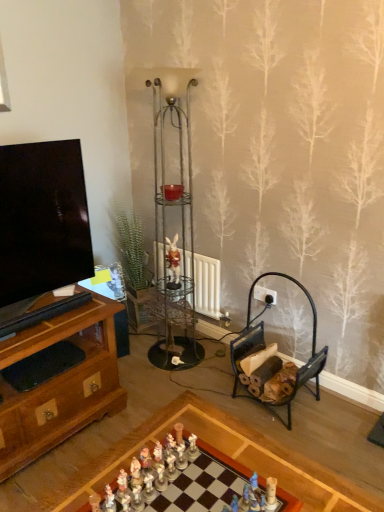
This screenshot has height=512, width=384. What are the coordinates of `free space above wooden chessboard at center (from a real-world perspective)` in the screenshot? It's located at (185, 486).